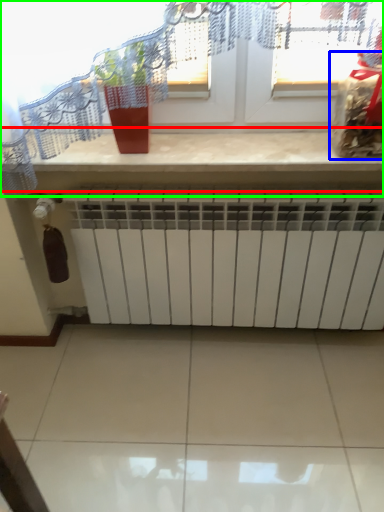
Question: Based on their relative distances, which object is nearer to counter top (highlighted by a red box)? Choose from food (highlighted by a blue box) and window (highlighted by a green box).

Choices:
 (A) food
 (B) window

Answer: (B)